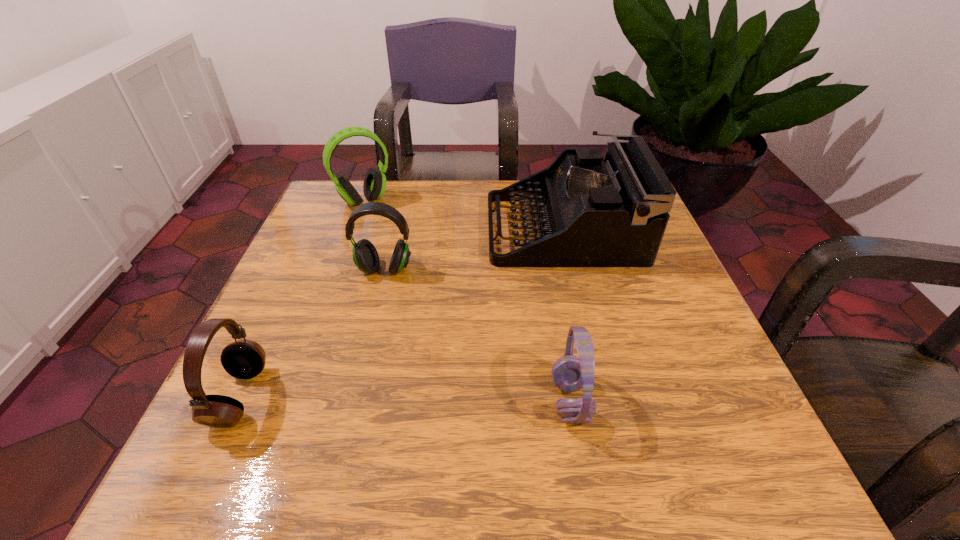
What are the coordinates of `free spot at the left edge of the desktop` in the screenshot? It's located at (343, 317).

Locate an element on the screen. free space at the right edge of the desktop is located at coordinates click(x=619, y=327).

In the image, there is a desktop. At what (x,y) coordinates should I click in order to perform the action: click on vacant space at the far left corner. Please return your answer as a coordinate pair (x, y). Looking at the image, I should click on (x=337, y=200).

At what (x,y) coordinates should I click in order to perform the action: click on vacant space at the near left corner of the desktop. Please return your answer as a coordinate pair (x, y). Looking at the image, I should click on (260, 433).

At what (x,y) coordinates should I click in order to perform the action: click on vacant point at the near right corner. Please return your answer as a coordinate pair (x, y). Looking at the image, I should click on (696, 435).

What are the coordinates of `empty space that is in between the tallest headset and the second farthest headset` in the screenshot? It's located at (374, 235).

This screenshot has width=960, height=540. Find the location of `free space between the third nearest headset and the rightmost headset`. free space between the third nearest headset and the rightmost headset is located at coordinates (477, 335).

The image size is (960, 540). Find the location of `free spot between the third nearest headset and the typewriter`. free spot between the third nearest headset and the typewriter is located at coordinates (474, 249).

Locate an element on the screen. The height and width of the screenshot is (540, 960). blank region between the farthest headset and the second farthest headset is located at coordinates (374, 235).

Find the location of a particular element. free space between the rightmost headset and the farthest headset is located at coordinates click(x=468, y=301).